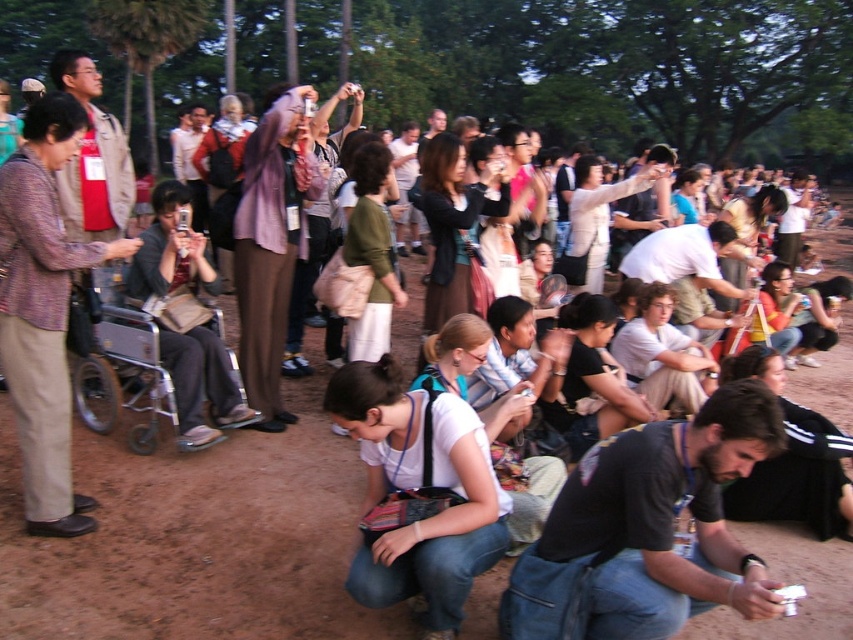
Question: Which object is farther from the camera taking this photo?

Choices:
 (A) white fabric shirt at center
 (B) dark gray fabric shirt at lower right

Answer: (A)

Question: Does dark gray fabric shirt at lower right have a greater width compared to white fabric shirt at center?

Choices:
 (A) no
 (B) yes

Answer: (B)

Question: Does dark gray fabric shirt at lower right appear over white fabric shirt at center?

Choices:
 (A) yes
 (B) no

Answer: (B)

Question: In this image, where is dark gray fabric shirt at lower right located relative to white fabric shirt at center?

Choices:
 (A) above
 (B) below

Answer: (B)

Question: Among these points, which one is nearest to the camera?

Choices:
 (A) (405, 532)
 (B) (608, 512)

Answer: (B)